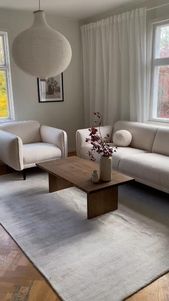
What are the coordinates of `coffee table leg` in the screenshot? It's located at (102, 201), (53, 183).